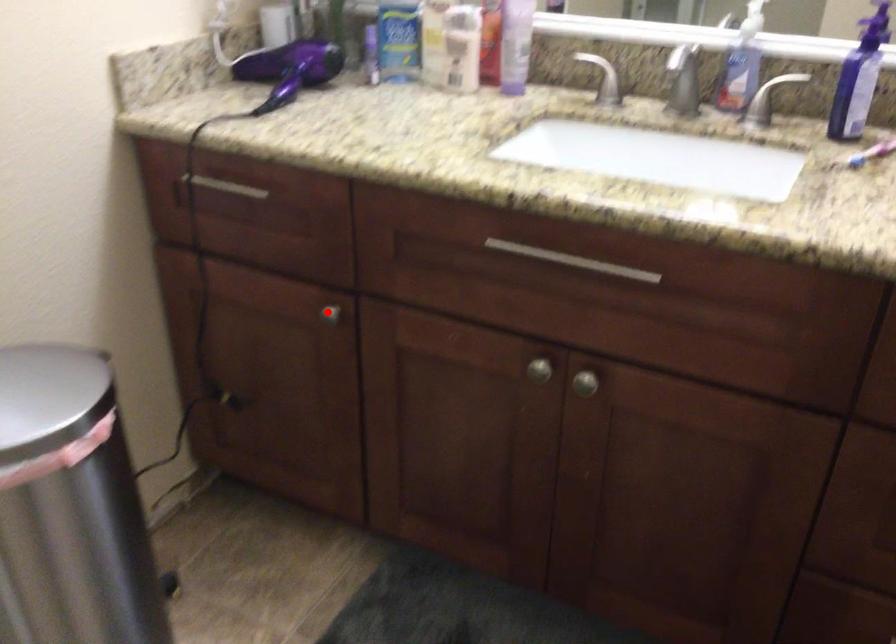
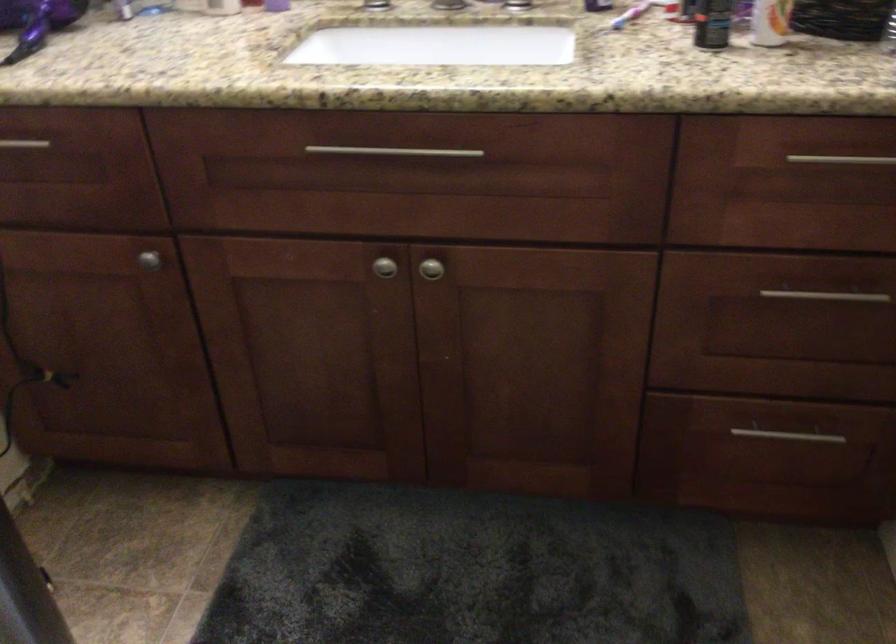
Where in the second image is the point corresponding to the highlighted location from the first image?

(149, 259)